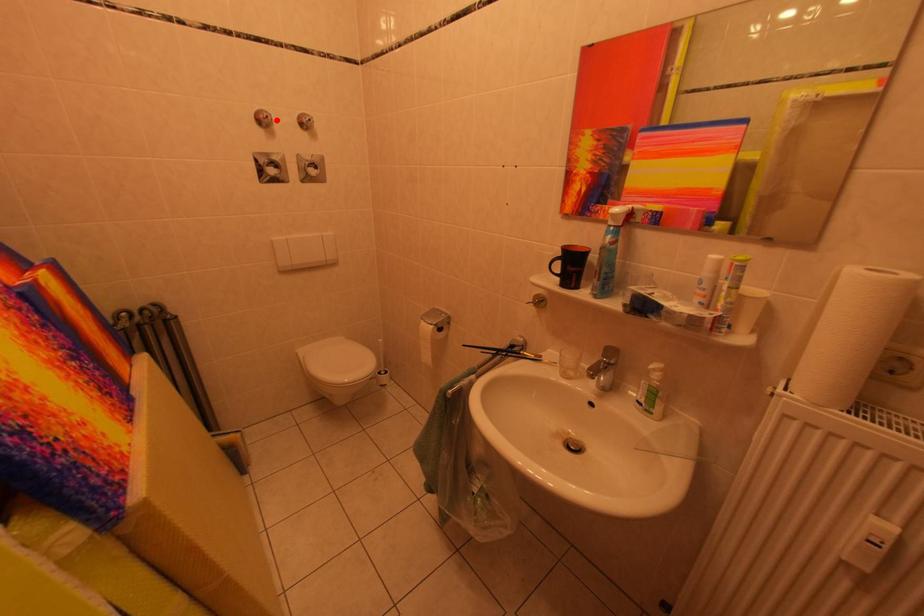
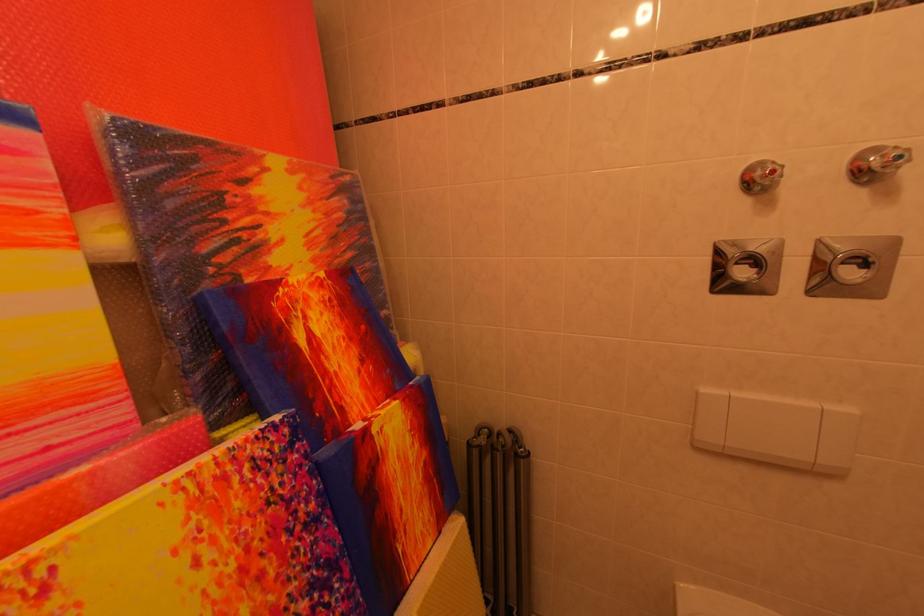
Locate, in the second image, the point that corresponds to the highlighted location in the first image.

(782, 176)